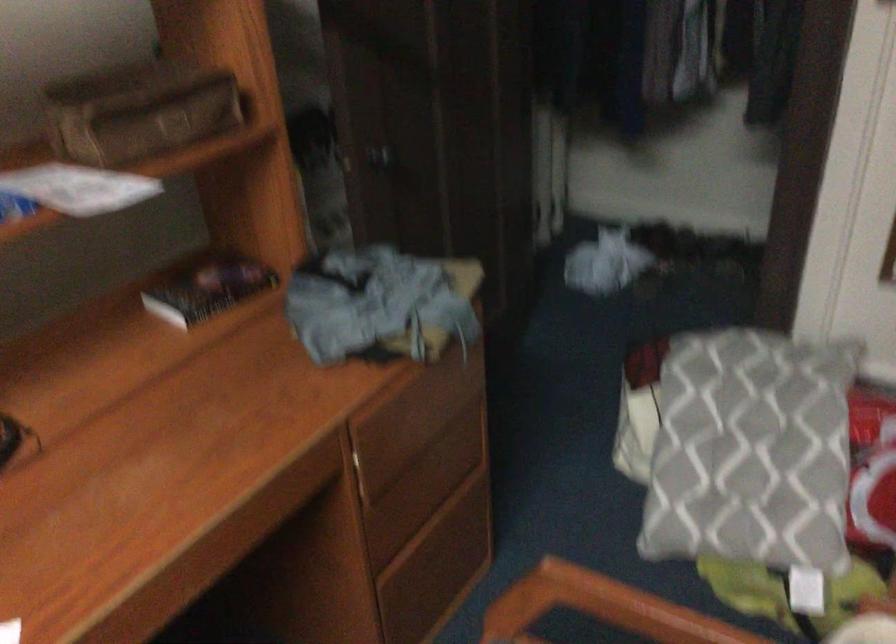
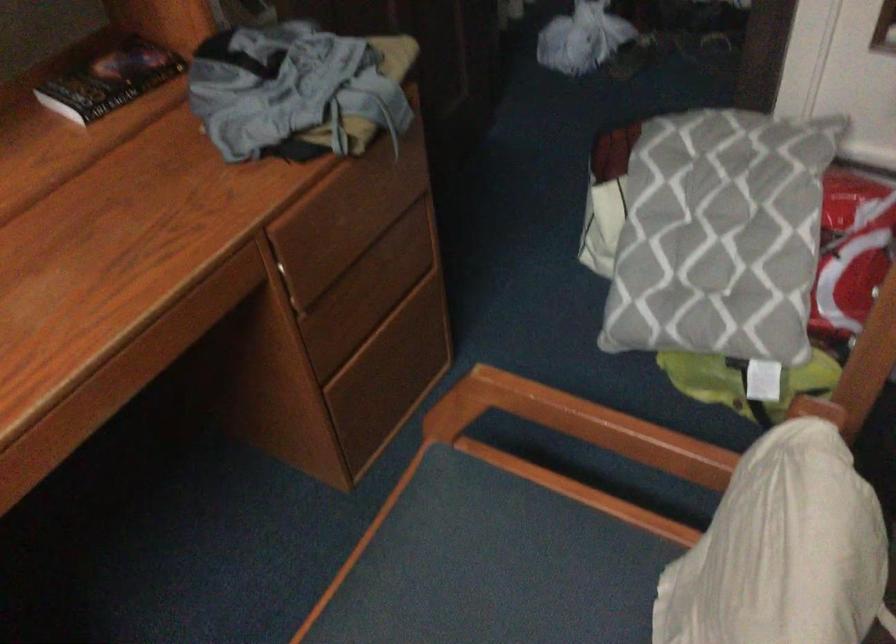
In the second image, find the point that corresponds to [207,290] in the first image.

(110, 80)